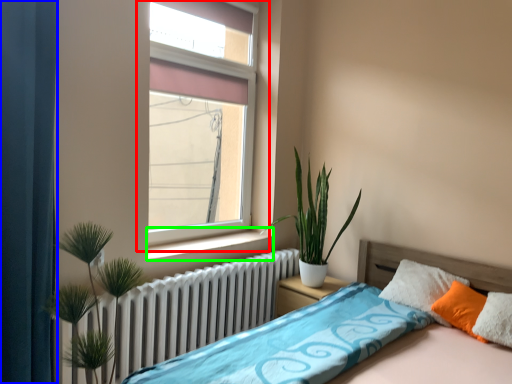
Question: Based on their relative distances, which object is nearer to window (highlighted by a red box)? Choose from curtain (highlighted by a blue box) and window sill (highlighted by a green box).

Choices:
 (A) curtain
 (B) window sill

Answer: (B)